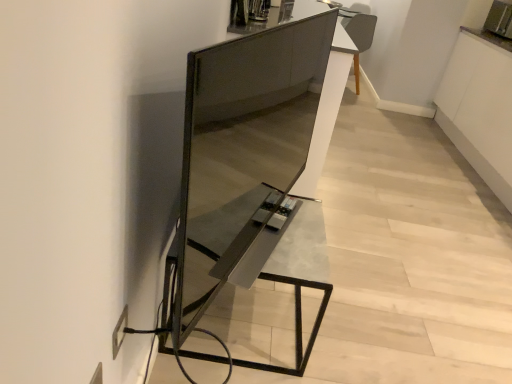
Question: Is satin black tv stand at center smaller than metallic gray table at center?

Choices:
 (A) yes
 (B) no

Answer: (A)

Question: From a real-world perspective, does satin black tv stand at center sit lower than metallic gray table at center?

Choices:
 (A) yes
 (B) no

Answer: (B)

Question: Is satin black tv stand at center outside metallic gray table at center?

Choices:
 (A) yes
 (B) no

Answer: (A)

Question: Considering the relative sizes of satin black tv stand at center and metallic gray table at center in the image provided, is satin black tv stand at center shorter than metallic gray table at center?

Choices:
 (A) yes
 (B) no

Answer: (B)

Question: Is satin black tv stand at center turned away from metallic gray table at center?

Choices:
 (A) yes
 (B) no

Answer: (B)

Question: From the image's perspective, is satin black tv stand at center over metallic gray table at center?

Choices:
 (A) no
 (B) yes

Answer: (B)

Question: Is metallic gray table at center far away from metallic silver toaster at upper right?

Choices:
 (A) no
 (B) yes

Answer: (B)

Question: Does metallic gray table at center lie behind metallic silver toaster at upper right?

Choices:
 (A) no
 (B) yes

Answer: (A)

Question: Is metallic gray table at center completely or partially outside of metallic silver toaster at upper right?

Choices:
 (A) no
 (B) yes

Answer: (B)

Question: Can you confirm if metallic gray table at center is thinner than metallic silver toaster at upper right?

Choices:
 (A) yes
 (B) no

Answer: (B)

Question: Is metallic silver toaster at upper right at the back of metallic gray table at center?

Choices:
 (A) no
 (B) yes

Answer: (A)

Question: From the image's perspective, would you say metallic gray table at center is shown under metallic silver toaster at upper right?

Choices:
 (A) yes
 (B) no

Answer: (A)

Question: Considering the relative sizes of metallic silver toaster at upper right and satin black tv stand at center in the image provided, is metallic silver toaster at upper right shorter than satin black tv stand at center?

Choices:
 (A) no
 (B) yes

Answer: (B)